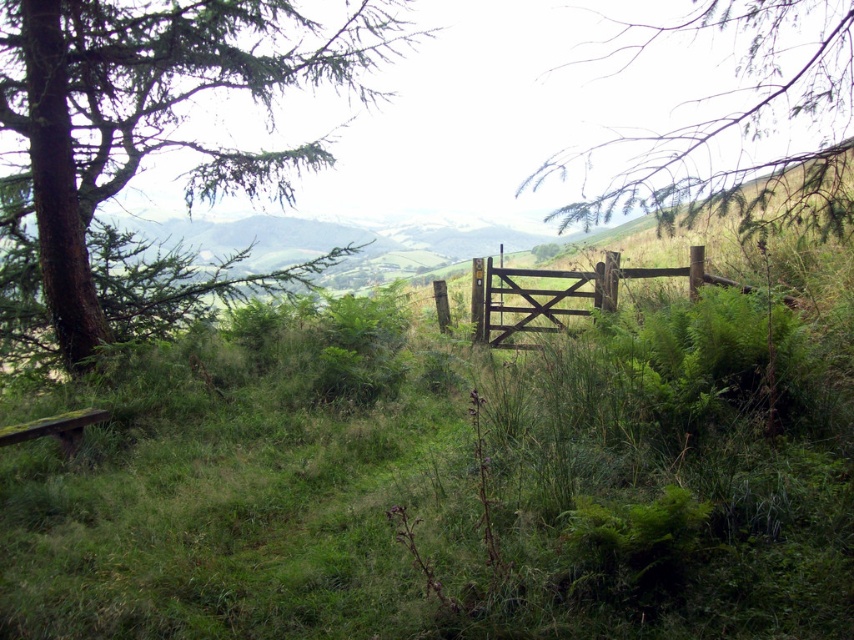
Question: Can you confirm if green leafy tree at upper left is bigger than brown wooden gate at center?

Choices:
 (A) no
 (B) yes

Answer: (B)

Question: Can you confirm if green leafy tree at upper left is wider than brown wooden gate at center?

Choices:
 (A) yes
 (B) no

Answer: (A)

Question: Is the position of green leafy tree at upper left more distant than that of brown wooden gate at center?

Choices:
 (A) no
 (B) yes

Answer: (A)

Question: Which of the following is the farthest from the observer?

Choices:
 (A) green leafy branch at upper right
 (B) brown wooden gate at center
 (C) green leafy tree at upper left

Answer: (B)

Question: Among these points, which one is nearest to the camera?

Choices:
 (A) (817, 189)
 (B) (568, 307)
 (C) (290, 32)

Answer: (A)

Question: Which of these objects is positioned farthest from the brown wooden gate at center?

Choices:
 (A) green leafy tree at upper left
 (B) green leafy branch at upper right

Answer: (A)